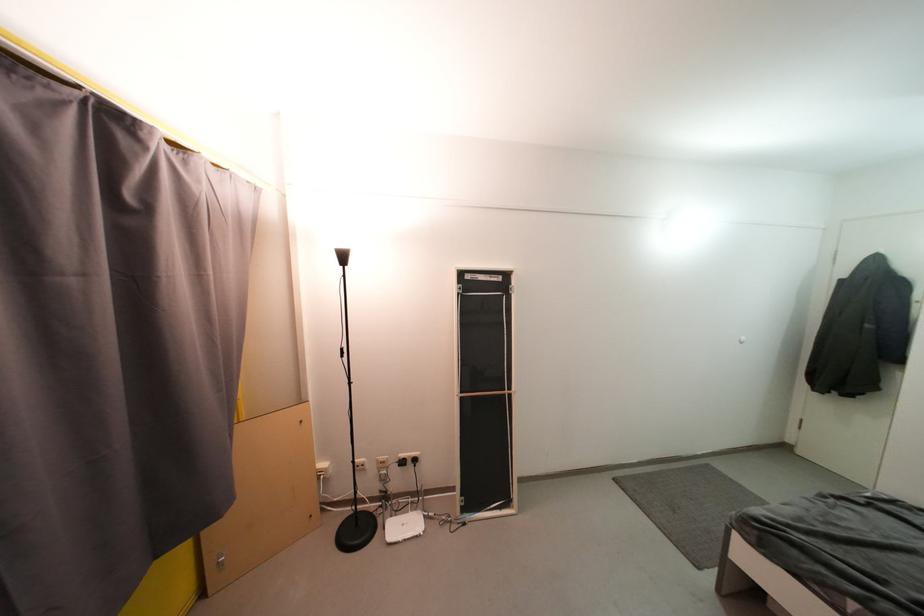
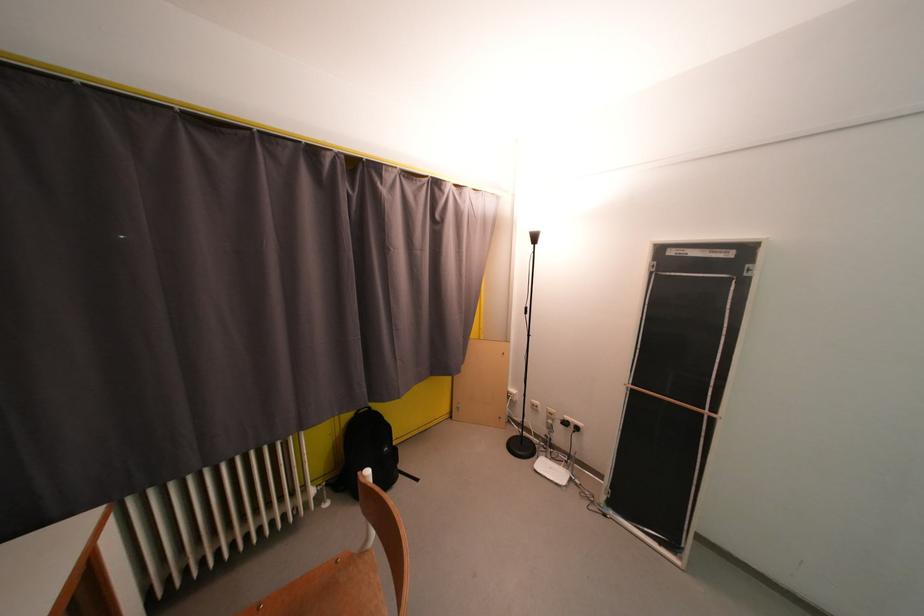
Find the pixel in the second image that matches point (409, 466) in the first image.

(573, 427)